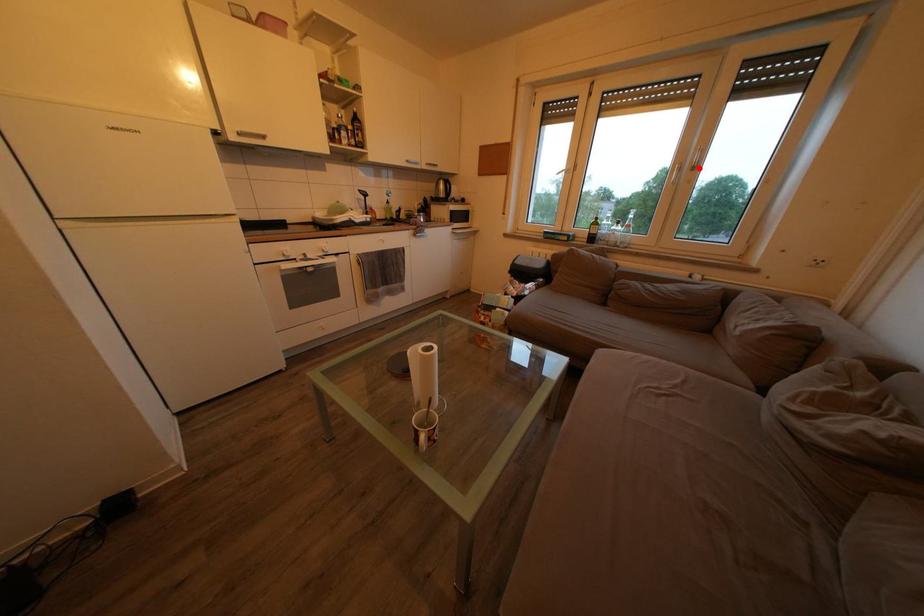
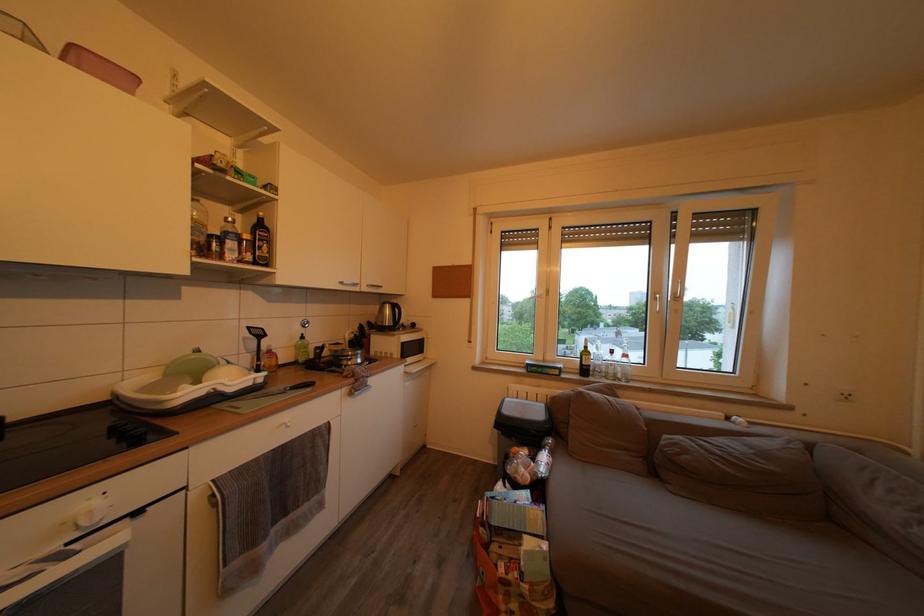
Question: I am providing you with two images of the same scene from different viewpoints. A red point is marked on the first image. Can you still see the location of the red point in image 2?

Choices:
 (A) Yes
 (B) No

Answer: (A)